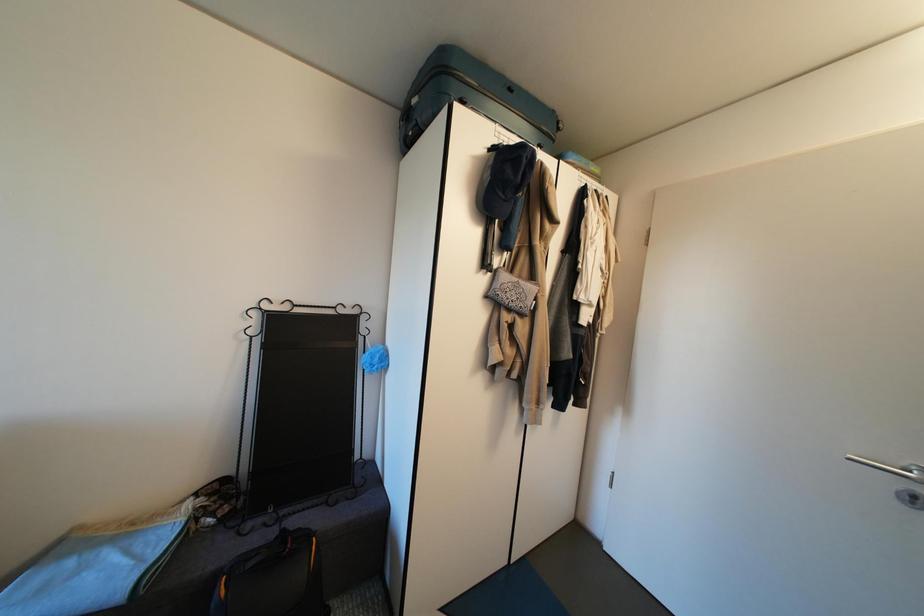
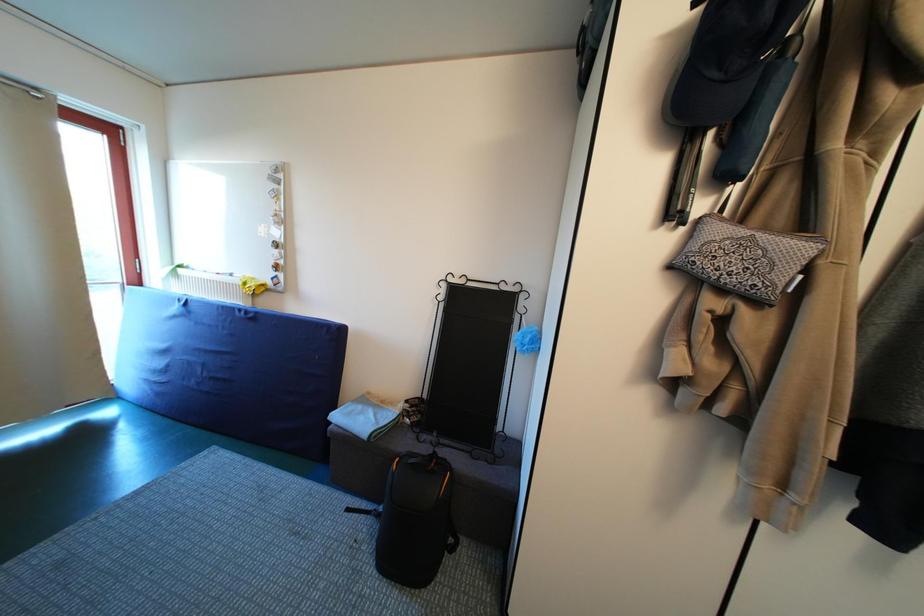
Question: The images are taken continuously from a first-person perspective. In which direction is your viewpoint rotating?

Choices:
 (A) Left
 (B) Right
 (C) Up
 (D) Down

Answer: (A)